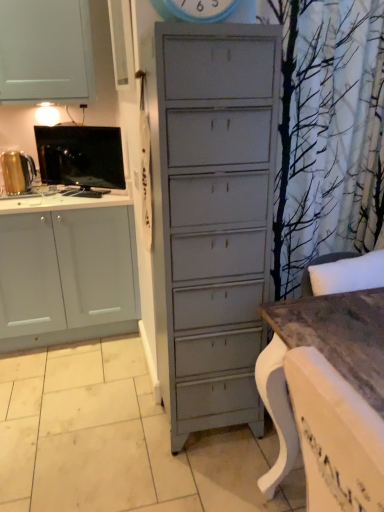
Question: Is black glossy tv at left, arranged as the first appliance when viewed from the right, situated inside gold metallic kettle at left, which ranks as the first appliance in left-to-right order, or outside?

Choices:
 (A) outside
 (B) inside

Answer: (A)

Question: Based on their positions, is black glossy tv at left, arranged as the first appliance when viewed from the right, located to the left or right of gold metallic kettle at left, the 2th appliance positioned from the right?

Choices:
 (A) right
 (B) left

Answer: (A)

Question: Estimate the real-world distances between objects in this image. Which object is closer to the gold metallic kettle at left, the 2th appliance positioned from the right?

Choices:
 (A) wooden table at lower right
 (B) black glossy tv at left, arranged as the first appliance when viewed from the right

Answer: (B)

Question: Based on their relative distances, which object is farther from the wooden table at lower right?

Choices:
 (A) black glossy tv at left, the 2th appliance from the left
 (B) gold metallic kettle at left, the 2th appliance positioned from the right

Answer: (B)